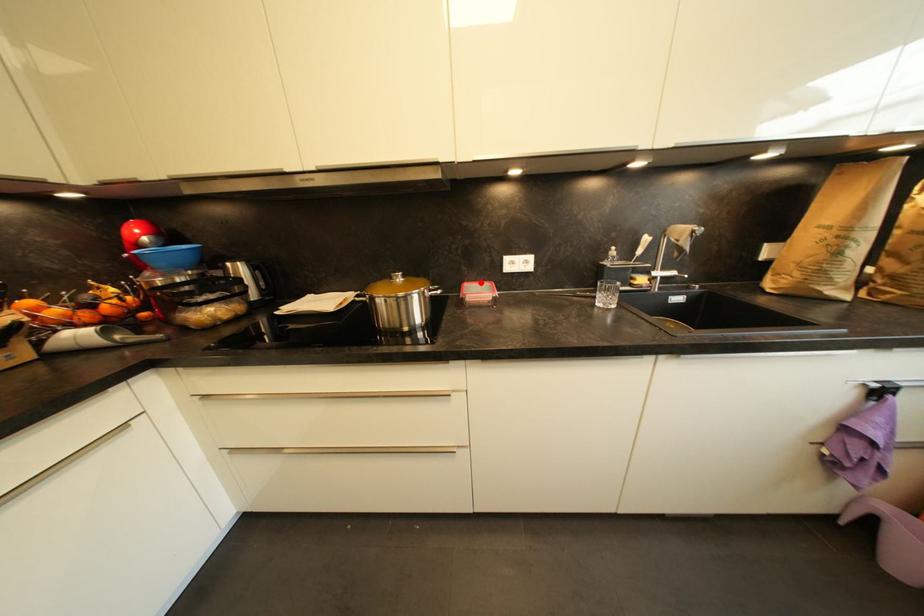
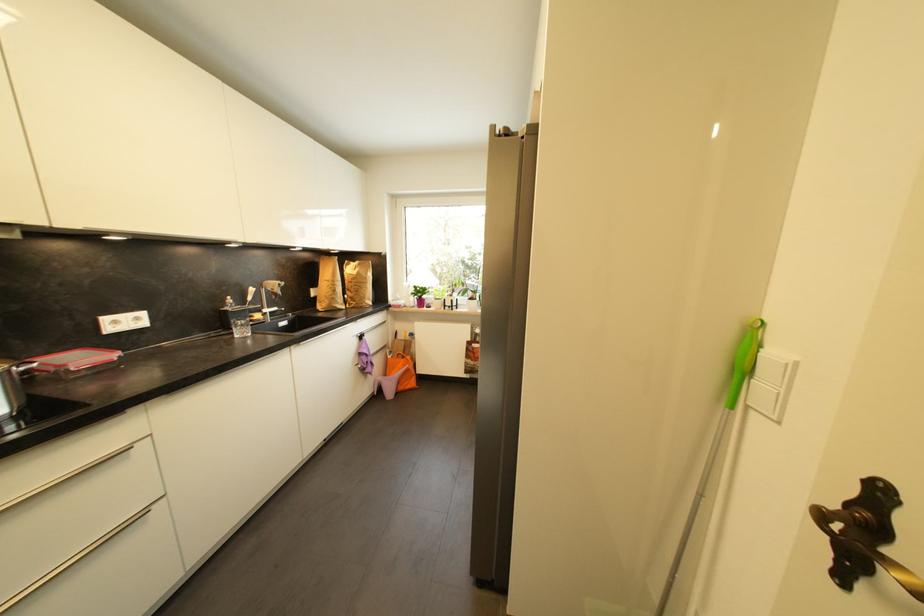
Question: A red point is marked in image1. In image2, is the corresponding 3D point closer to the camera or farther? Reply with the corresponding letter.

Choices:
 (A) The corresponding 3D point is closer.
 (B) The corresponding 3D point is farther.

Answer: (B)